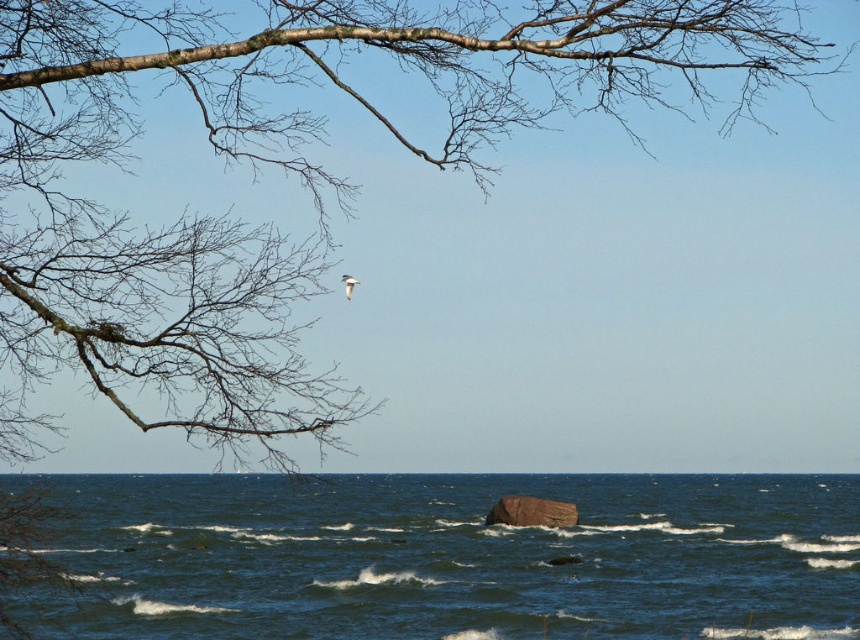
In the scene shown: Between dark blue water at center and brown rough rock at center, which one has less height?

Standing shorter between the two is brown rough rock at center.

Is dark blue water at center behind brown rough rock at center?

No, dark blue water at center is closer to the viewer.

In order to click on dark blue water at center in this screenshot , I will do (452, 556).

Where is `dark blue water at center`? This screenshot has height=640, width=860. dark blue water at center is located at coordinates (452, 556).